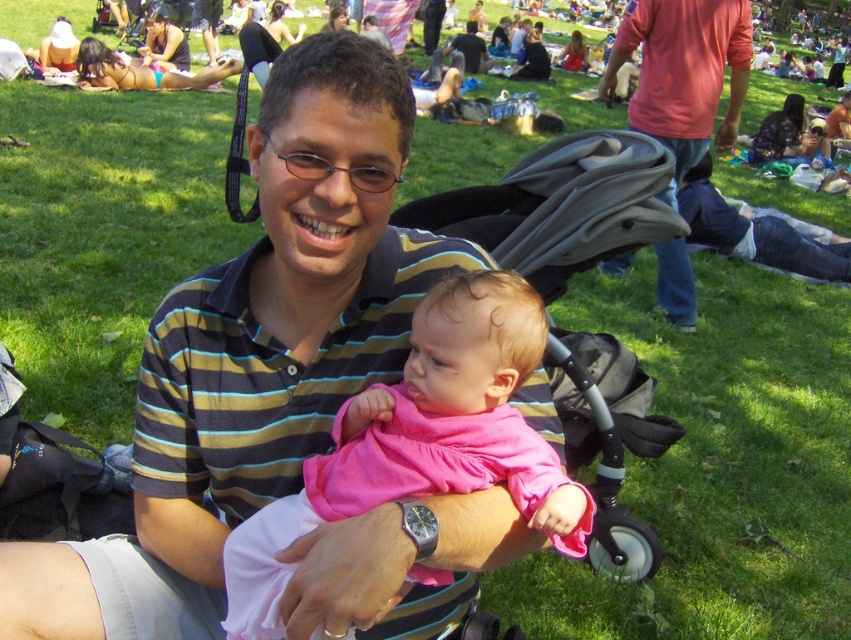
Question: Is pink fabric baby at center behind matte pink shirt at upper right?

Choices:
 (A) yes
 (B) no

Answer: (B)

Question: Is pink fabric baby at center smaller than matte pink shirt at upper right?

Choices:
 (A) no
 (B) yes

Answer: (B)

Question: Does pink fabric baby at center have a larger size compared to matte pink shirt at upper right?

Choices:
 (A) no
 (B) yes

Answer: (A)

Question: Which of the following is the closest to the observer?

Choices:
 (A) (621, 28)
 (B) (490, 426)

Answer: (B)